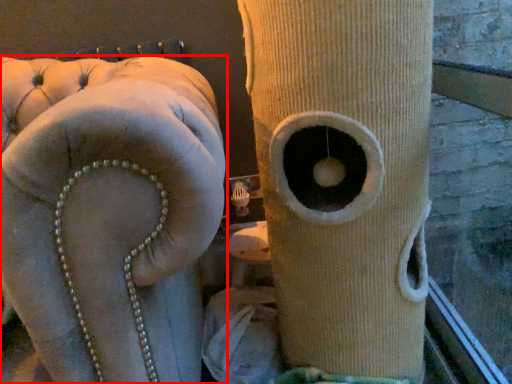
Question: In this image, where is furniture (annotated by the red box) located relative to tree trunk?

Choices:
 (A) left
 (B) right

Answer: (A)